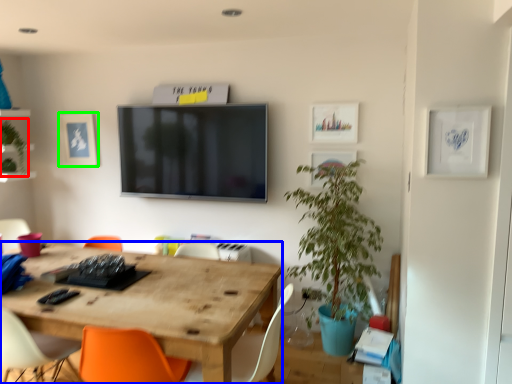
Question: Which object is positioned farthest from plant (highlighted by a red box)? Select from desk (highlighted by a blue box) and picture frame (highlighted by a green box).

Choices:
 (A) desk
 (B) picture frame

Answer: (A)